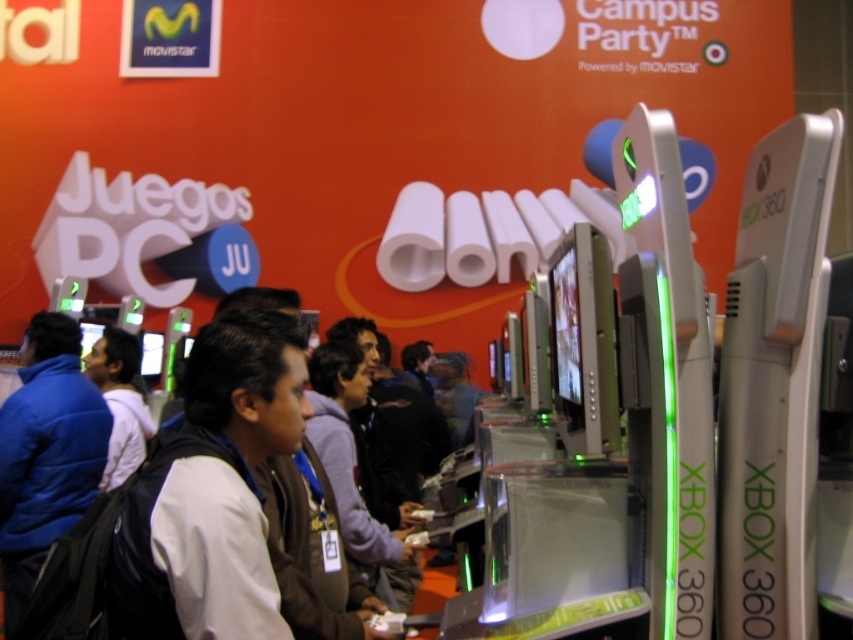
You are attending the Campus Party event and notice two people in the crowd. One is wearing a blue puffy jacket at left and the other has a white matte shirt at center. From your perspective, which clothing item is covering part of the other?

The blue puffy jacket at left is positioned over the white matte shirt at center, so it is covering part of it.

You are at the Campus Party event and notice two jackets displayed on mannequins. The blue puffy jacket at left and the brown fabric jacket at center. Which jacket is shorter in height?

The blue puffy jacket at left is not as tall as the brown fabric jacket at center, so the blue puffy jacket at left is shorter in height.